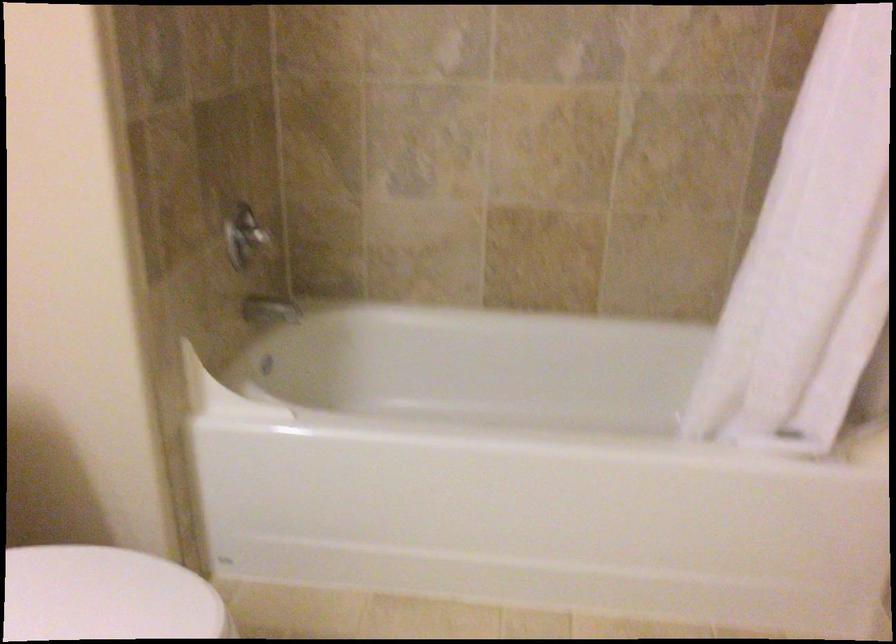
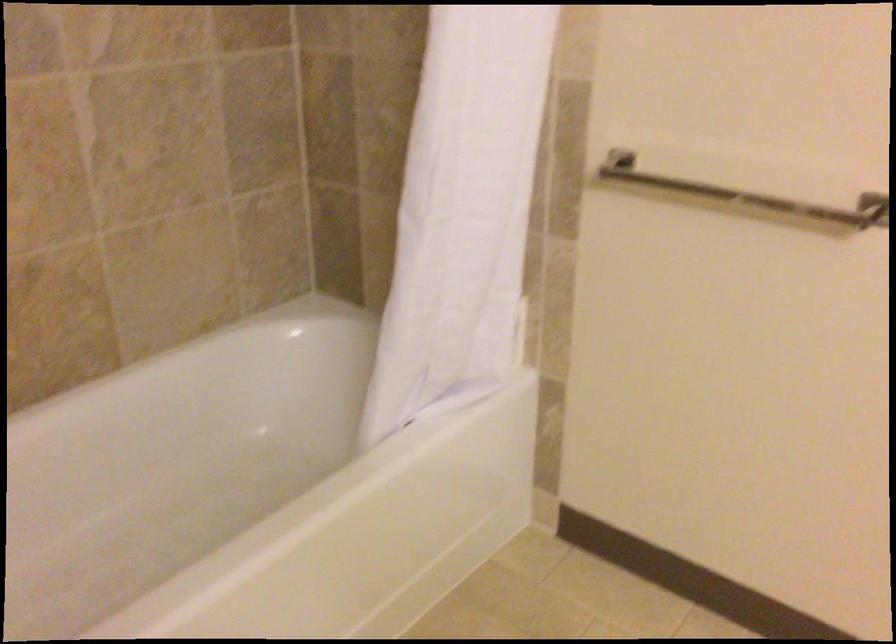
Question: Based on the continuous images, in which direction is the camera rotating? Reply with the corresponding letter.

Choices:
 (A) Left
 (B) Right
 (C) Up
 (D) Down

Answer: (B)